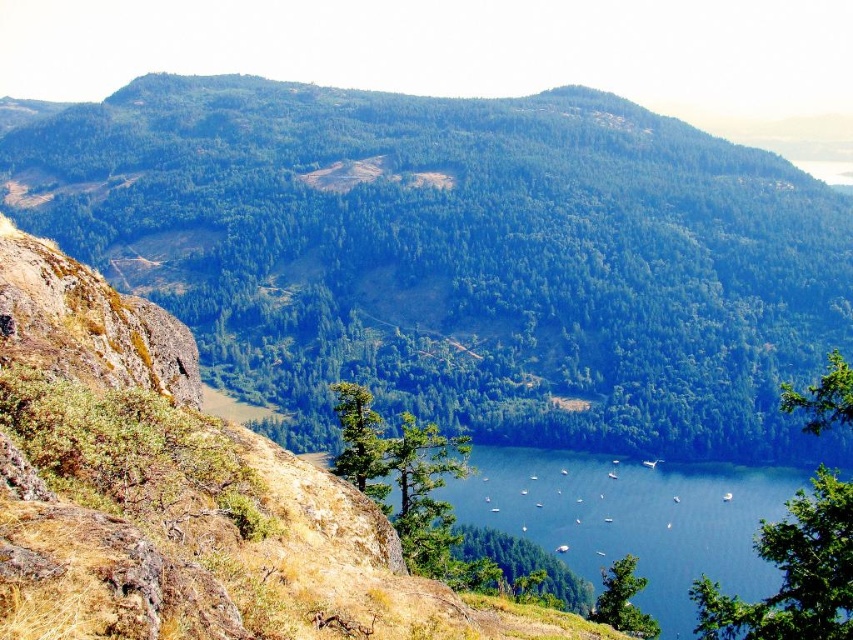
Is green forested mountain at center further to the viewer compared to blue water at center?

Yes.

Can you confirm if green forested mountain at center is bigger than blue water at center?

Yes, green forested mountain at center is bigger than blue water at center.

Between point (561, 276) and point (670, 504), which one is positioned in front?

Point (670, 504) is in front.

This screenshot has height=640, width=853. I want to click on green forested mountain at center, so click(x=457, y=257).